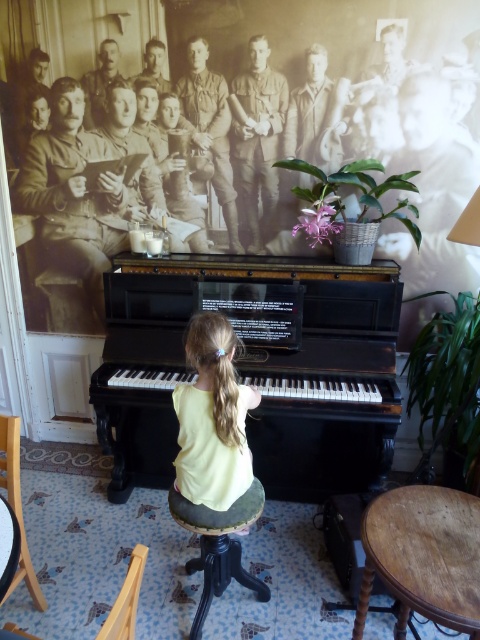
You are a visitor entering the room and want to sit down. There are two wooden items at lower left, a wooden chair at lower left and a wooden at lower left. Which one is more likely to be a seat?

The wooden chair at lower left is taller than wooden at lower left, so it is more likely to be a seat since chairs are typically taller than other wooden items like tables or stands.

You are standing in the room and want to move from the wooden at lower left to the dark wood stool at center. Which direction should you move?

You should move to the right to reach the dark wood stool at center from the wooden at lower left since the dark wood stool at center is to the right of wooden at lower left.

You are standing in the room and want to sit down to watch the girl play the piano. Is the wooden chair at lower left close enough for you to reach comfortably?

The wooden chair at lower left is 1.41 meters away from viewer, so yes, it is close enough to reach comfortably.